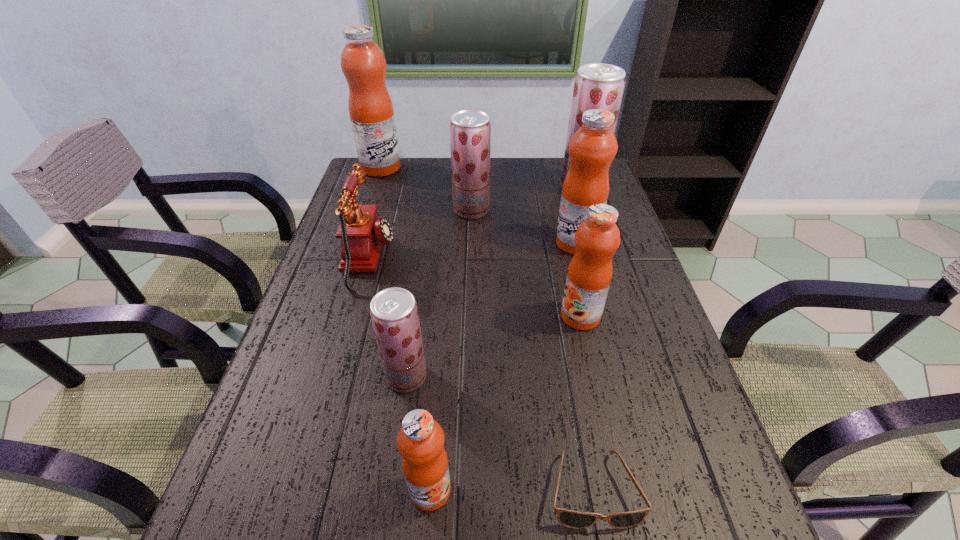
Where is `vacant position in the image that satisfies the following two spatial constraints: 1. on the front label of the fourth nearest object; 2. on the front label of the nearest orange fruit juice`? The height and width of the screenshot is (540, 960). vacant position in the image that satisfies the following two spatial constraints: 1. on the front label of the fourth nearest object; 2. on the front label of the nearest orange fruit juice is located at coordinates (619, 490).